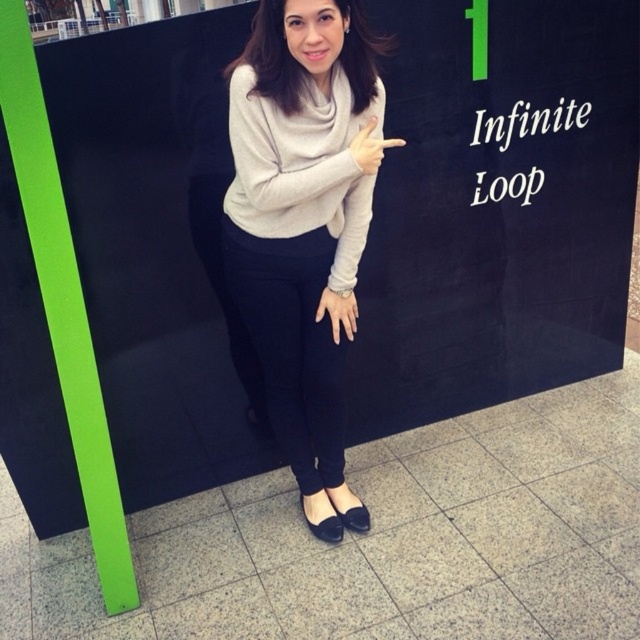
Question: Which point appears farthest from the camera in this image?

Choices:
 (A) (273, 394)
 (B) (278, 152)
 (C) (348, 321)

Answer: (A)

Question: Considering the relative positions of matte gray sweater at center and matte white ring at center in the image provided, where is matte gray sweater at center located with respect to matte white ring at center?

Choices:
 (A) below
 (B) above

Answer: (B)

Question: Considering the real-world distances, which object is farthest from the matte gray sweater at center?

Choices:
 (A) matte white ring at center
 (B) light gray knit sweater at center

Answer: (A)

Question: Is matte gray sweater at center in front of matte white ring at center?

Choices:
 (A) yes
 (B) no

Answer: (A)

Question: Does matte gray sweater at center appear over light gray knit sweater at center?

Choices:
 (A) yes
 (B) no

Answer: (B)

Question: Which object is farther from the camera taking this photo?

Choices:
 (A) matte gray sweater at center
 (B) matte gray finger at upper center
 (C) light gray knit sweater at center
 (D) matte white ring at center

Answer: (D)